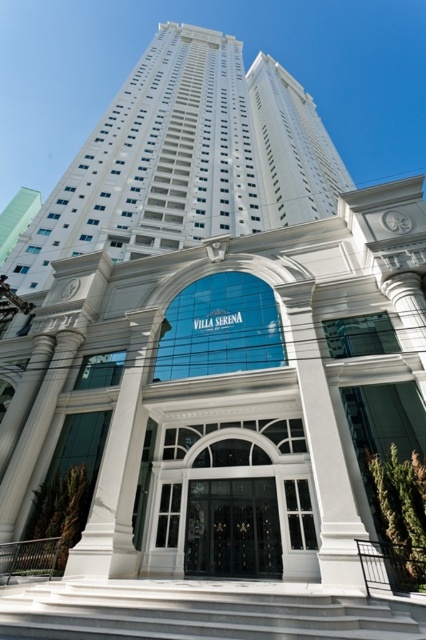
Between white smooth building at upper center and black glass door at center, which one has more height?

white smooth building at upper center is taller.

Between point (77, 195) and point (221, 547), which one is positioned behind?

The point (77, 195) is more distant.

I want to click on white smooth building at upper center, so click(187, 160).